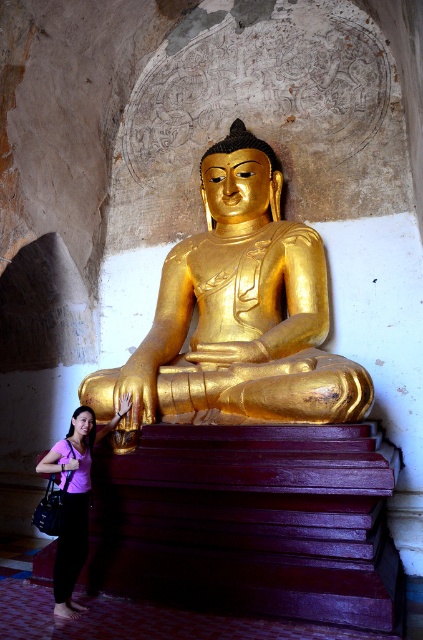
Question: Which of the following is the farthest from the observer?

Choices:
 (A) (126, 396)
 (B) (332, 497)
 (C) (172, 305)

Answer: (C)

Question: Can you confirm if gold polished statue at center is bigger than purple fabric shirt at lower left?

Choices:
 (A) no
 (B) yes

Answer: (B)

Question: Which of the following is the farthest from the observer?

Choices:
 (A) purple fabric shirt at lower left
 (B) wooden stairs at center

Answer: (A)

Question: Among these objects, which one is nearest to the camera?

Choices:
 (A) wooden stairs at center
 (B) purple fabric shirt at lower left
 (C) gold polished statue at center

Answer: (A)

Question: Is wooden stairs at center to the right of gold polished statue at center from the viewer's perspective?

Choices:
 (A) yes
 (B) no

Answer: (A)

Question: Is gold polished statue at center further to camera compared to purple fabric shirt at lower left?

Choices:
 (A) no
 (B) yes

Answer: (B)